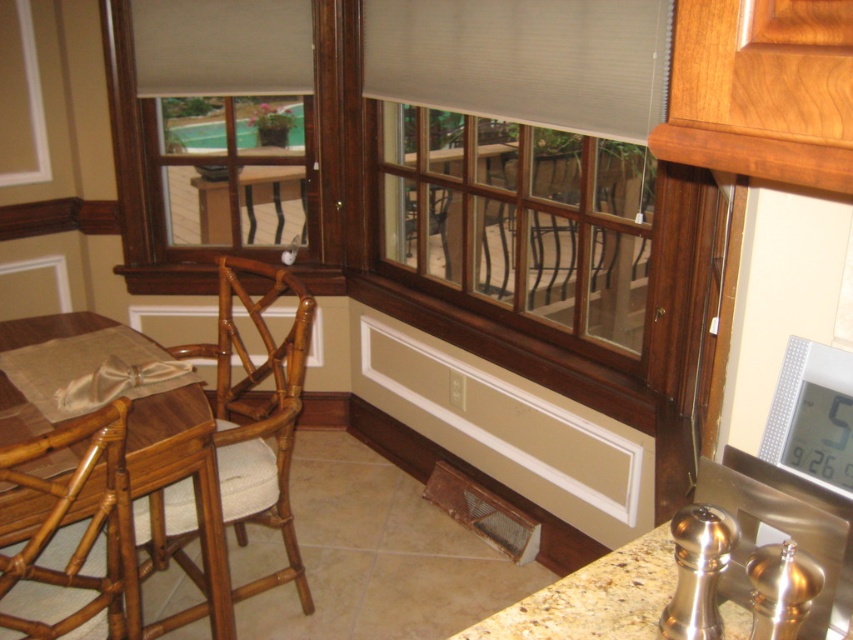
Who is lower down, matte gray blind at upper center or matte wood bay window at left?

Positioned lower is matte wood bay window at left.

Does matte gray blind at upper center appear on the right side of matte wood bay window at left?

Indeed, matte gray blind at upper center is positioned on the right side of matte wood bay window at left.

You are a GUI agent. You are given a task and a screenshot of the screen. Output one action in this format:
    pyautogui.click(x=<x>, y=<y>)
    Task: Click on the matte gray blind at upper center
    The image size is (853, 640).
    Given the screenshot: What is the action you would take?
    pyautogui.click(x=525, y=60)

Can you confirm if bamboo table at left is wider than matte wood bay window at left?

No, bamboo table at left is not wider than matte wood bay window at left.

Between bamboo table at left and matte wood bay window at left, which one is positioned higher?

Positioned higher is matte wood bay window at left.

Between point (209, 600) and point (316, 268), which one is positioned in front?

Point (209, 600) is more forward.

Identify the location of bamboo table at left. (184, 476).

Which of these two, granite countertop at lower right or matte wood bay window at left, stands taller?

matte wood bay window at left is taller.

Who is lower down, granite countertop at lower right or matte wood bay window at left?

granite countertop at lower right

Is point (833, 625) farther from camera compared to point (154, 252)?

No.

This screenshot has height=640, width=853. What are the coordinates of `granite countertop at lower right` in the screenshot? It's located at (776, 541).